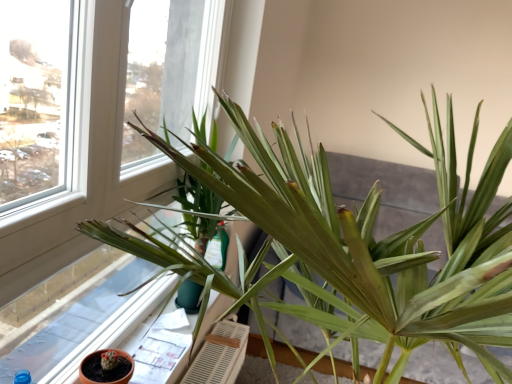
Question: Should I look upward or downward to see green leafy plant at center?

Choices:
 (A) up
 (B) down

Answer: (B)